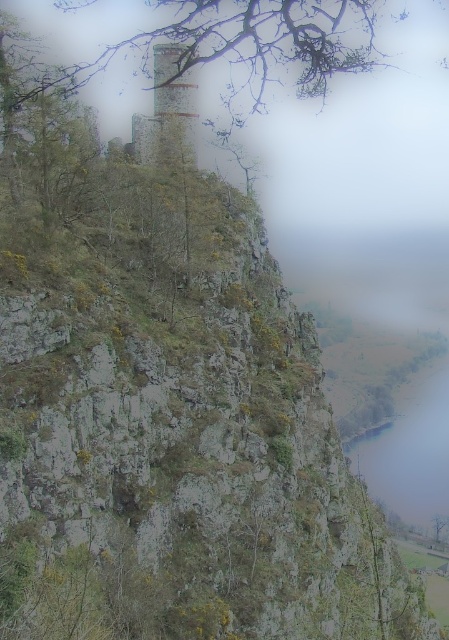
Who is positioned more to the right, bare branches at upper center or rustic stone tower at center?

bare branches at upper center is more to the right.

Which of these two, bare branches at upper center or rustic stone tower at center, stands taller?

Standing taller between the two is bare branches at upper center.

Where is `bare branches at upper center`? The width and height of the screenshot is (449, 640). bare branches at upper center is located at coordinates (224, 40).